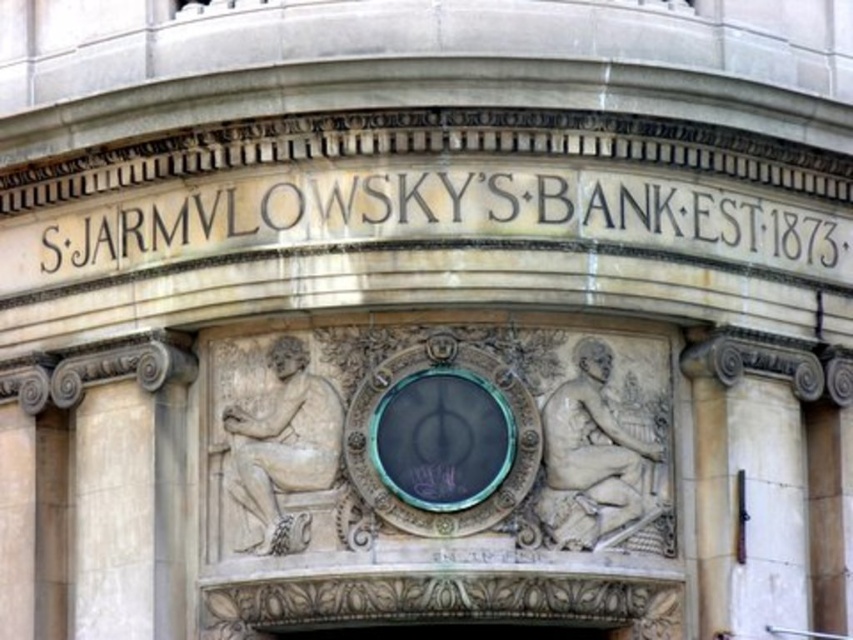
You are an architect analyzing the symmetry of the classical facade. The green glass clock at center is positioned at coordinates 0.686 on the x and 0.519 on the y. Does this placement align with the central axis of the structure?

The green glass clock at center is located at coordinates 0.686 on the x and 0.519 on the y. Since the central axis of a symmetrical structure would typically be at x coordinate 0.5, the clock is offset to the right, indicating it may not align with the central axis.

You are an architect inspecting a historical building. You notice an object at point (442, 438). What is the object located at that coordinate?

The object at point (442, 438) is a green glass clock at center.